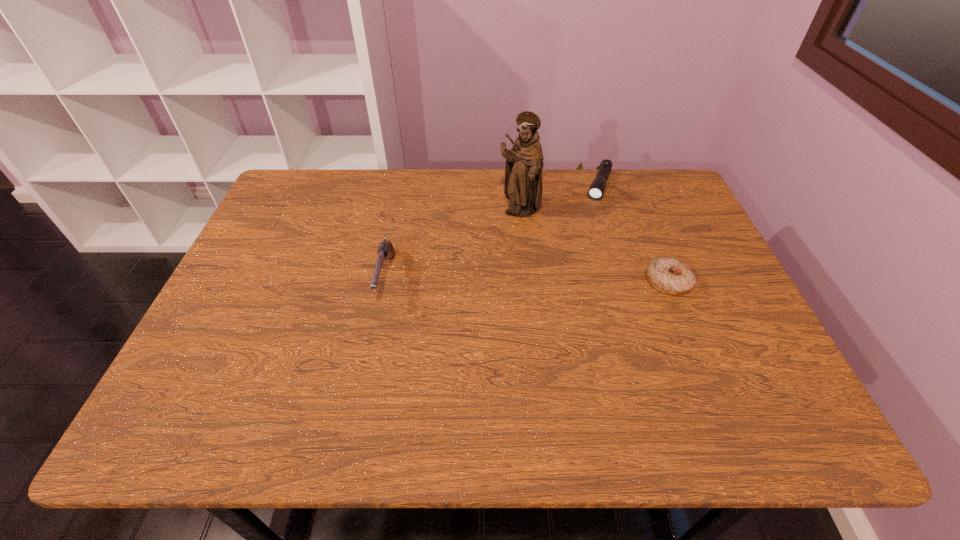
Identify the location of unoccupied area between the flashlight and the third object from right to left. Image resolution: width=960 pixels, height=540 pixels. (559, 199).

Find the location of a particular element. This screenshot has height=540, width=960. empty space that is in between the third shortest object and the tallest object is located at coordinates (452, 246).

This screenshot has width=960, height=540. What are the coordinates of `the second closest object relative to the third object from right to left` in the screenshot? It's located at (671, 276).

The height and width of the screenshot is (540, 960). I want to click on the closest object to the figurine, so click(x=596, y=190).

Find the location of a particular element. This screenshot has width=960, height=540. free spot that satisfies the following two spatial constraints: 1. on the front side of the doughnut; 2. on the right side of the flashlight is located at coordinates [x=631, y=282].

Locate an element on the screen. blank area in the image that satisfies the following two spatial constraints: 1. on the back side of the tallest object; 2. on the right side of the flashlight is located at coordinates (516, 185).

The height and width of the screenshot is (540, 960). Identify the location of vacant space that satisfies the following two spatial constraints: 1. aiming along the barrel of the leftmost object; 2. on the left side of the doughnut. (386, 282).